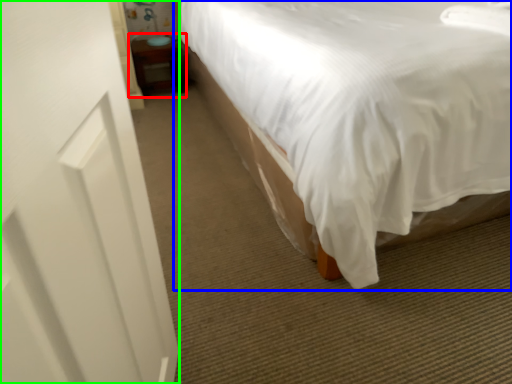
Question: Which object is the farthest from table (highlighted by a red box)? Choose among these: bed (highlighted by a blue box) or screen door (highlighted by a green box).

Choices:
 (A) bed
 (B) screen door

Answer: (B)